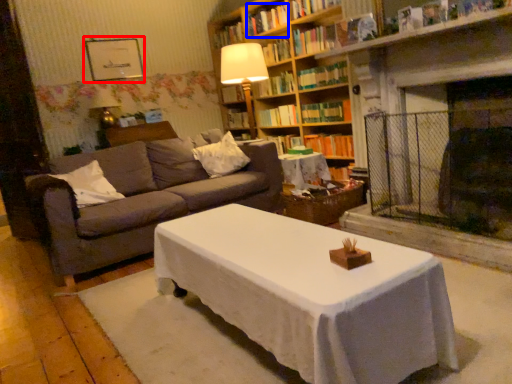
Question: Which of the following is the farthest to the observer, picture frame (highlighted by a red box) or book (highlighted by a blue box)?

Choices:
 (A) picture frame
 (B) book

Answer: (A)